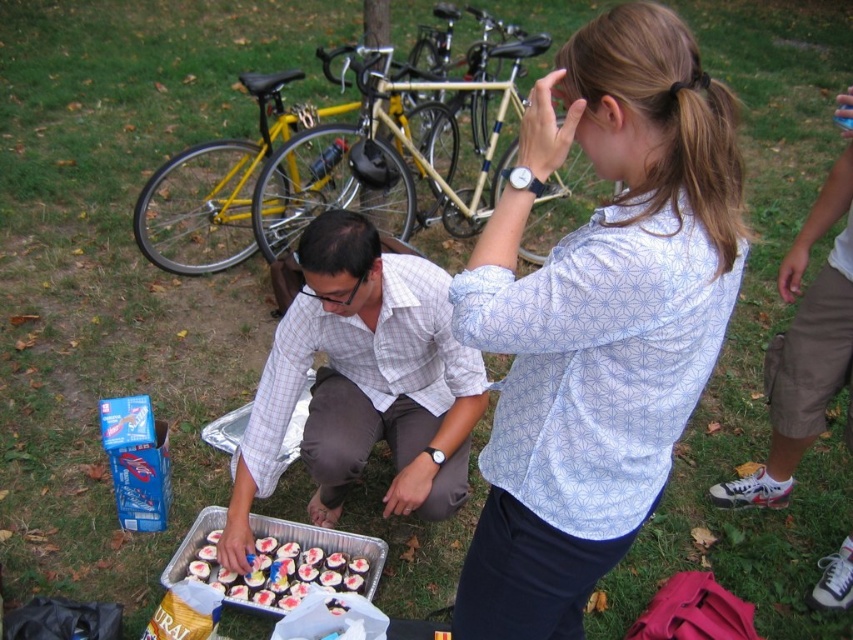
Consider the image. You are a caterer at an outdoor event and need to quickly retrieve the chocolate frosted cupcakes at lower center. You are currently standing next to the white printed shirt at center. Can you reach the cupcakes without moving more than 3 feet?

The distance between the white printed shirt at center and the chocolate frosted cupcakes at lower center is 3.35 feet, which is slightly more than 3 feet. Therefore, you would need to move a bit further to reach them.

You are at the picnic and want to locate the person wearing the light gray checkered shirt at center. According to the coordinates provided, where should you look?

The light gray checkered shirt at center is located at point 0.600 on the x axis and 0.424 on the y axis.

You are at an outdoor event and see two shirts at the center of the image. Which shirt is nearer to you, the white printed shirt at center or the light gray checkered shirt at center?

The white printed shirt at center is closer to the viewer than the light gray checkered shirt at center.